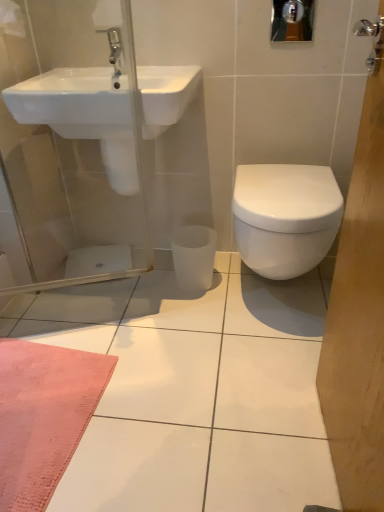
The width and height of the screenshot is (384, 512). What do you see at coordinates (74, 103) in the screenshot?
I see `white glossy sink at upper left` at bounding box center [74, 103].

What is the approximate height of white glossy toilet at right?

It is 20.11 inches.

Identify the location of white glossy sink at upper left. The width and height of the screenshot is (384, 512). (74, 103).

Is white glossy sink at upper left with white glossy toilet at right?

white glossy sink at upper left is not next to white glossy toilet at right, and they're not touching.

From the image's perspective, is white glossy sink at upper left under white glossy toilet at right?

No, from the image's perspective, white glossy sink at upper left is not beneath white glossy toilet at right.

Is white glossy sink at upper left wider or thinner than white glossy toilet at right?

Considering their sizes, white glossy sink at upper left looks slimmer than white glossy toilet at right.

What's the angular difference between white glossy sink at upper left and white glossy toilet at right's facing directions?

The facing directions of white glossy sink at upper left and white glossy toilet at right are 0.628 degrees apart.

Which object is further away from the camera, silver metallic tap at upper left or white glossy sink at upper left?

silver metallic tap at upper left.

From the image's perspective, which one is positioned higher, silver metallic tap at upper left or white glossy sink at upper left?

silver metallic tap at upper left.

Consider the image. Measure the distance between silver metallic tap at upper left and white glossy sink at upper left.

silver metallic tap at upper left and white glossy sink at upper left are 28.75 centimeters apart.

Is silver metallic tap at upper left at the right side of white glossy sink at upper left?

Yes.

Could you tell me if silver metallic tap at upper left is turned towards white glossy toilet at right?

No, silver metallic tap at upper left does not turn towards white glossy toilet at right.

You are a GUI agent. You are given a task and a screenshot of the screen. Output one action in this format:
    pyautogui.click(x=<x>, y=<y>)
    Task: Click on the toilet in front of the silver metallic tap at upper left
    The height and width of the screenshot is (512, 384).
    Given the screenshot: What is the action you would take?
    pyautogui.click(x=285, y=217)

Is there a large distance between silver metallic tap at upper left and white glossy toilet at right?

They are positioned close to each other.

Is silver metallic tap at upper left shorter than white glossy toilet at right?

Yes.

Is silver metallic tap at upper left surrounded by white glossy sink at upper left?

No, silver metallic tap at upper left is not a part of white glossy sink at upper left.

Does point (171, 88) appear closer or farther from the camera than point (117, 42)?

Clearly, point (171, 88) is more distant from the camera than point (117, 42).

Based on the photo, can you confirm if white glossy sink at upper left is positioned to the right of silver metallic tap at upper left?

Incorrect, white glossy sink at upper left is not on the right side of silver metallic tap at upper left.

Is white glossy sink at upper left touching silver metallic tap at upper left?

No, white glossy sink at upper left is not making contact with silver metallic tap at upper left.

Considering the positions of points (315, 240) and (111, 103), is point (315, 240) farther from camera compared to point (111, 103)?

Yes, point (315, 240) is farther from viewer.

Which is more to the right, white glossy toilet at right or white glossy sink at upper left?

white glossy toilet at right.

Looking at this image, can you confirm if white glossy toilet at right is thinner than white glossy sink at upper left?

No.

Looking at the image, does white glossy toilet at right seem bigger or smaller compared to white glossy sink at upper left?

Clearly, white glossy toilet at right is larger in size than white glossy sink at upper left.

Can you confirm if white glossy toilet at right is bigger than silver metallic tap at upper left?

Yes, white glossy toilet at right is bigger than silver metallic tap at upper left.

Choose the correct answer: Is white glossy toilet at right inside silver metallic tap at upper left or outside it?

white glossy toilet at right is located beyond the bounds of silver metallic tap at upper left.

Are white glossy toilet at right and silver metallic tap at upper left far apart?

No, white glossy toilet at right is not far from silver metallic tap at upper left.

Looking at their sizes, would you say white glossy toilet at right is wider or thinner than silver metallic tap at upper left?

Considering their sizes, white glossy toilet at right looks broader than silver metallic tap at upper left.

Where is `sink that is above the white glossy toilet at right (from a real-world perspective)`? This screenshot has height=512, width=384. sink that is above the white glossy toilet at right (from a real-world perspective) is located at coordinates (x=74, y=103).

At what (x,y) coordinates should I click in order to perform the action: click on sink to the left of silver metallic tap at upper left. Please return your answer as a coordinate pair (x, y). Looking at the image, I should click on (74, 103).

When comparing their distances from white glossy sink at upper left, does silver metallic tap at upper left or white glossy toilet at right seem closer?

silver metallic tap at upper left is closer to white glossy sink at upper left.

Looking at the image, which one is located further to silver metallic tap at upper left, white glossy sink at upper left or white glossy toilet at right?

white glossy toilet at right.

Based on their spatial positions, is white glossy toilet at right or silver metallic tap at upper left further from white glossy sink at upper left?

white glossy toilet at right lies further to white glossy sink at upper left than the other object.

From the image, which object appears to be nearer to white glossy toilet at right, silver metallic tap at upper left or white glossy sink at upper left?

white glossy sink at upper left is positioned closer to the anchor white glossy toilet at right.

Consider the image. Looking at the image, which one is located further to silver metallic tap at upper left, white glossy toilet at right or white glossy sink at upper left?

white glossy toilet at right is further to silver metallic tap at upper left.

When comparing their distances from white glossy toilet at right, does white glossy sink at upper left or silver metallic tap at upper left seem closer?

The object closer to white glossy toilet at right is white glossy sink at upper left.

The height and width of the screenshot is (512, 384). I want to click on tap between white glossy sink at upper left and white glossy toilet at right in the horizontal direction, so coord(114,47).